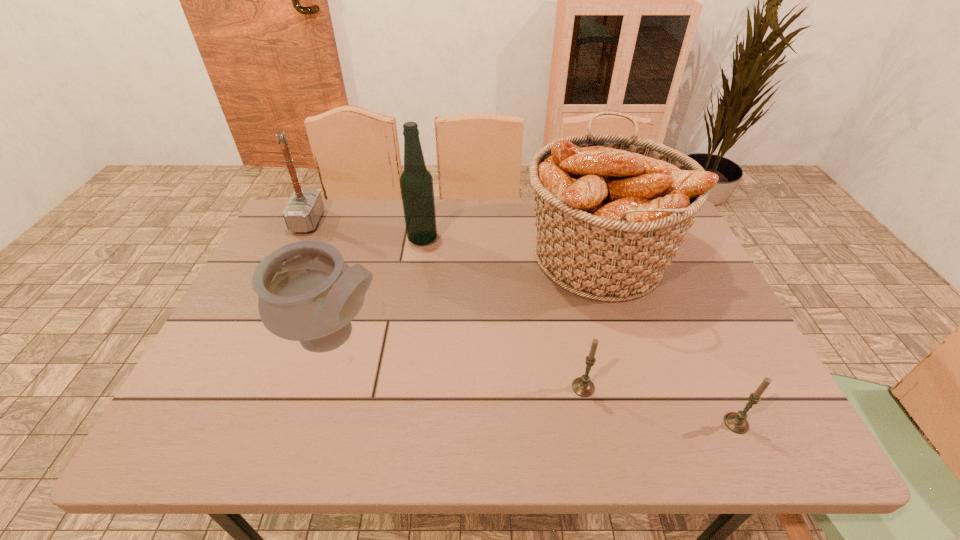
Where is `object that can be found as the second closest to the pottery`? The image size is (960, 540). object that can be found as the second closest to the pottery is located at coordinates (305, 207).

Point out which object is positioned as the nearest to the pottery. Please provide its 2D coordinates. Your answer should be formatted as a tuple, i.e. [(x, y)], where the tuple contains the x and y coordinates of a point satisfying the conditions above.

[(416, 183)]

This screenshot has width=960, height=540. In order to click on free spot that satisfies the following two spatial constraints: 1. on the front side of the basket; 2. on the left side of the alcohol in this screenshot , I will do `click(420, 258)`.

At what (x,y) coordinates should I click in order to perform the action: click on free space that satisfies the following two spatial constraints: 1. on the back side of the pottery; 2. on the right side of the basket. Please return your answer as a coordinate pair (x, y). This screenshot has width=960, height=540. Looking at the image, I should click on (358, 258).

Identify the location of free location that satisfies the following two spatial constraints: 1. on the back side of the basket; 2. on the striking surface of the hammer. This screenshot has width=960, height=540. (588, 221).

Where is `free space that satisfies the following two spatial constraints: 1. on the back side of the alcohol; 2. on the striking surface of the hammer`? The width and height of the screenshot is (960, 540). free space that satisfies the following two spatial constraints: 1. on the back side of the alcohol; 2. on the striking surface of the hammer is located at coordinates (425, 221).

Locate an element on the screen. blank area in the image that satisfies the following two spatial constraints: 1. on the striking surface of the fifth farthest object; 2. on the right side of the leftmost object is located at coordinates (228, 387).

Locate an element on the screen. free location that satisfies the following two spatial constraints: 1. on the back side of the basket; 2. on the right side of the pottery is located at coordinates (358, 258).

The width and height of the screenshot is (960, 540). I want to click on vacant space that satisfies the following two spatial constraints: 1. on the striking surface of the alcohol; 2. on the left side of the leftmost object, so click(x=300, y=239).